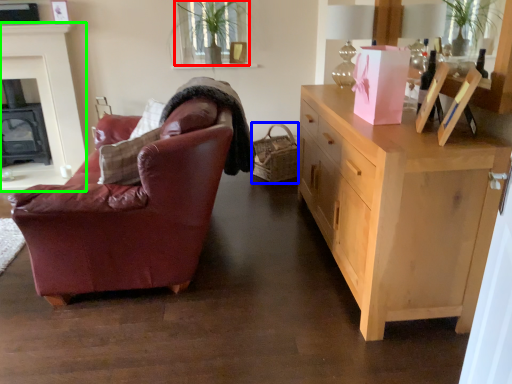
Question: Estimate the real-world distances between objects in this image. Which object is closer to plant (highlighted by a red box), picnic basket (highlighted by a blue box) or fireplace (highlighted by a green box)?

Choices:
 (A) picnic basket
 (B) fireplace

Answer: (A)